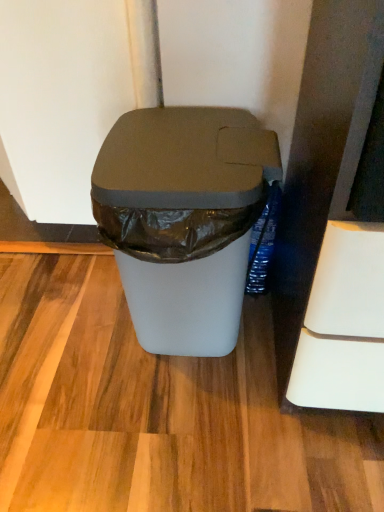
At what (x,y) coordinates should I click in order to perform the action: click on white plastic trash can at center. Please return your answer as a coordinate pair (x, y). Image resolution: width=384 pixels, height=512 pixels. Looking at the image, I should click on (183, 219).

The height and width of the screenshot is (512, 384). What do you see at coordinates (183, 219) in the screenshot?
I see `white plastic trash can at center` at bounding box center [183, 219].

Locate an element on the screen. Image resolution: width=384 pixels, height=512 pixels. white plastic trash can at center is located at coordinates (183, 219).